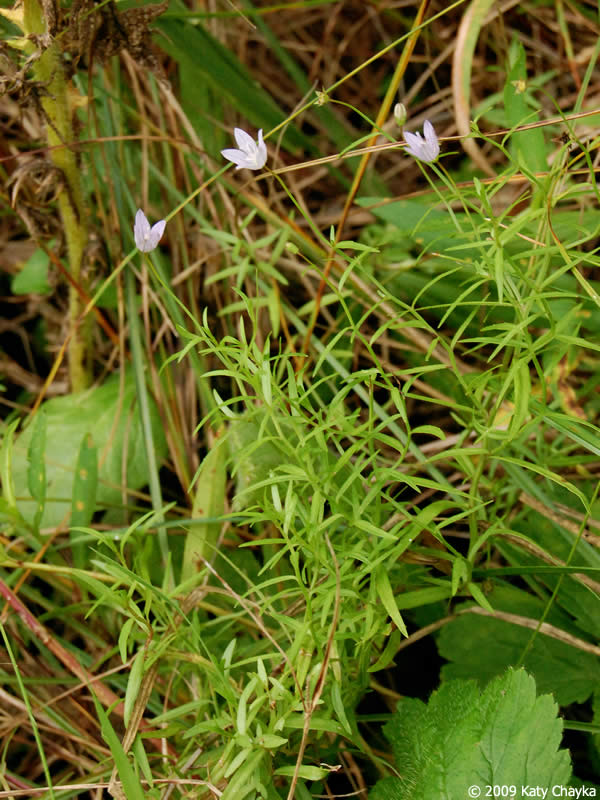
I want to click on middle small flower, so click(x=243, y=146).